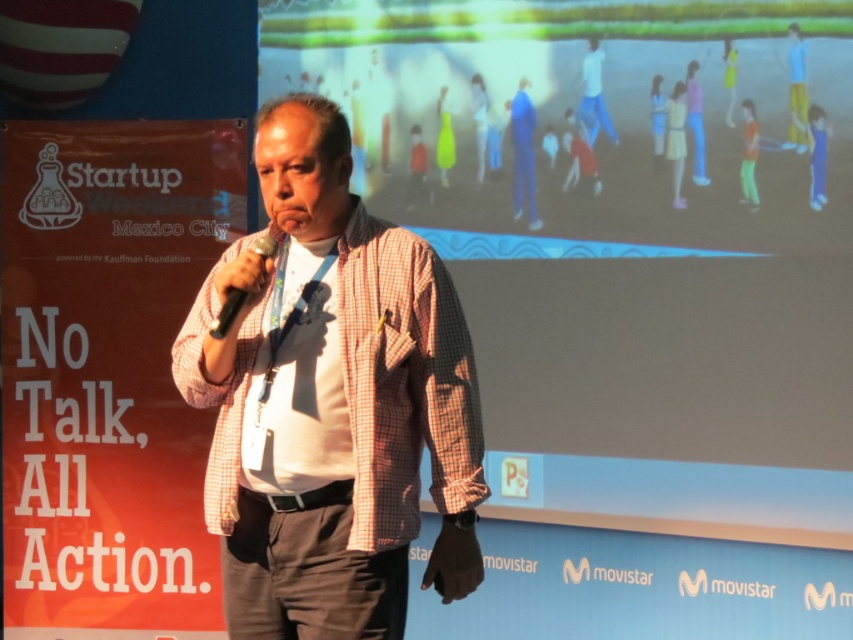
Between checkered fabric shirt at center and black plastic microphone at center, which one appears on the left side from the viewer's perspective?

Positioned to the left is black plastic microphone at center.

Which is behind, point (453, 324) or point (271, 257)?

Positioned behind is point (453, 324).

This screenshot has height=640, width=853. In order to click on checkered fabric shirt at center in this screenshot , I will do `click(331, 401)`.